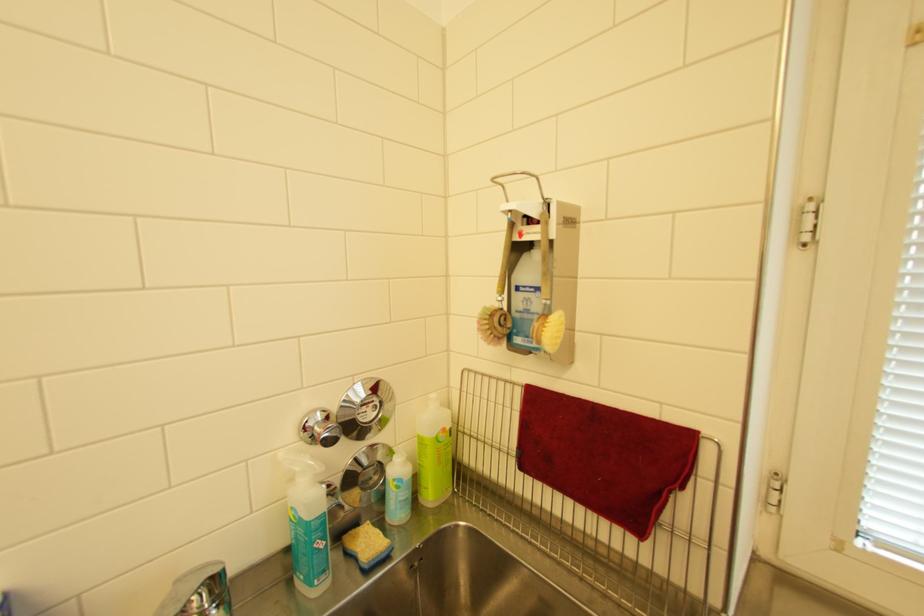
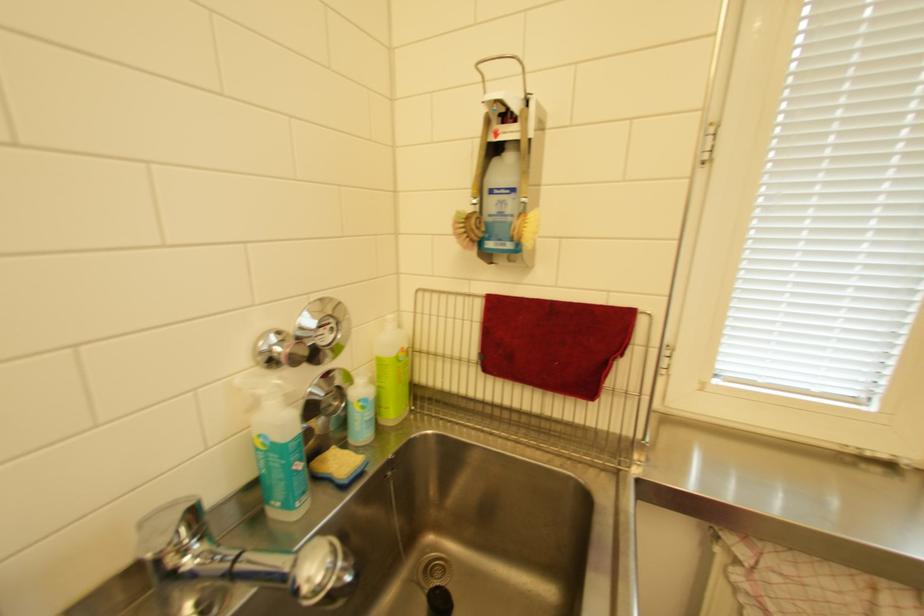
In the second image, find the point that corresponds to (x=500, y=315) in the first image.

(475, 217)